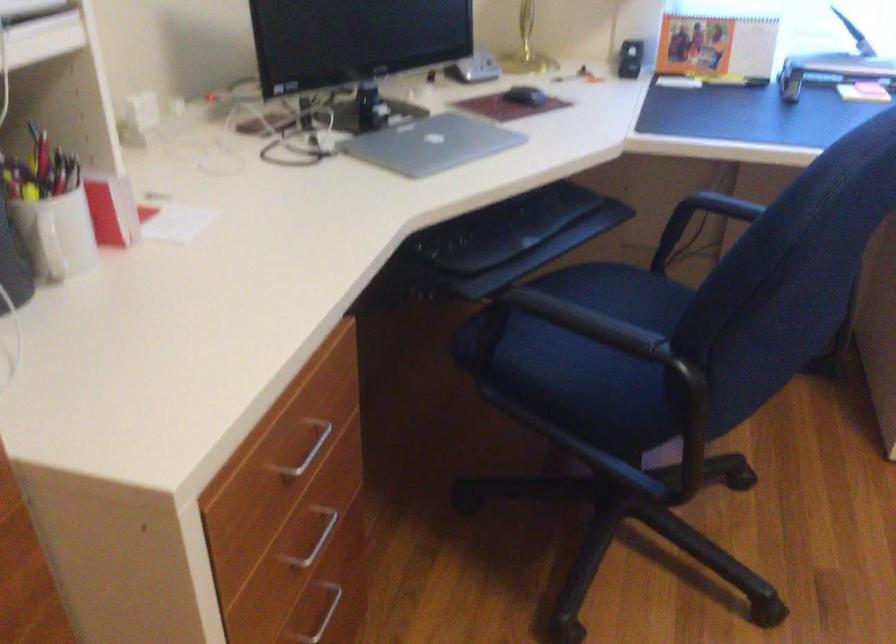
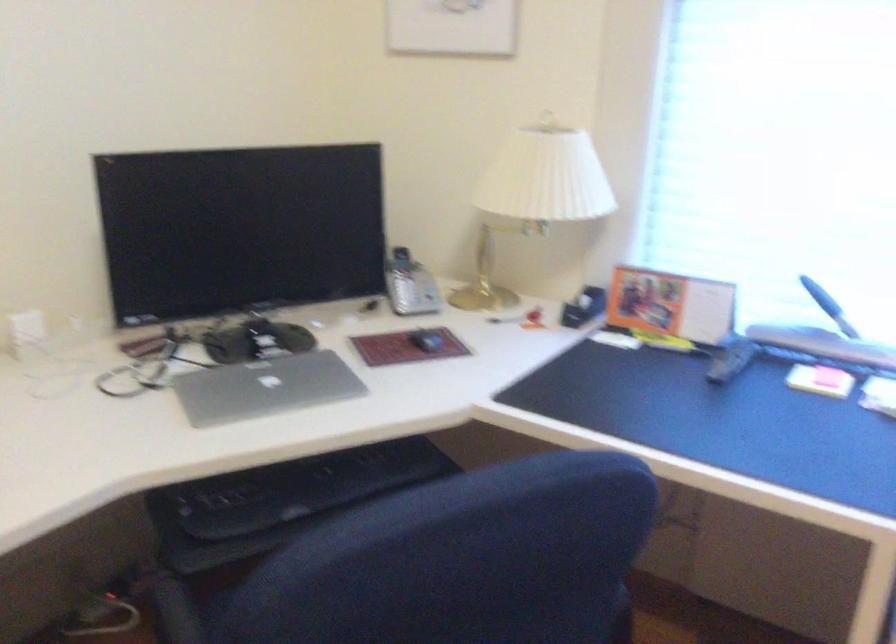
Question: Which direction would the cameraman need to move to produce the second image? Reply with the corresponding letter.

Choices:
 (A) Left
 (B) Right
 (C) Forward
 (D) Backward

Answer: (B)